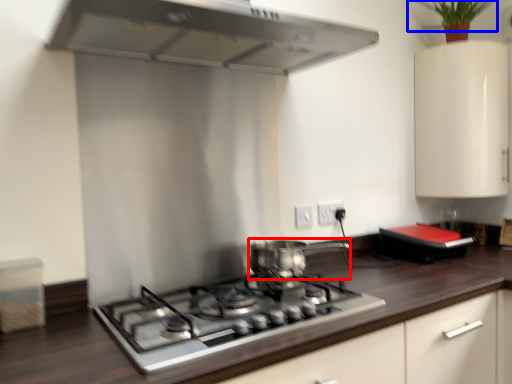
Question: Which object appears closest to the camera in this image, kitchen appliance (highlighted by a red box) or plant (highlighted by a blue box)?

Choices:
 (A) kitchen appliance
 (B) plant

Answer: (A)